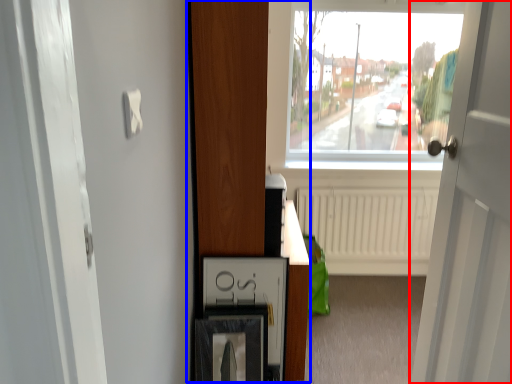
Question: Which object is closer to the camera taking this photo, door (highlighted by a red box) or dresser (highlighted by a blue box)?

Choices:
 (A) door
 (B) dresser

Answer: (A)